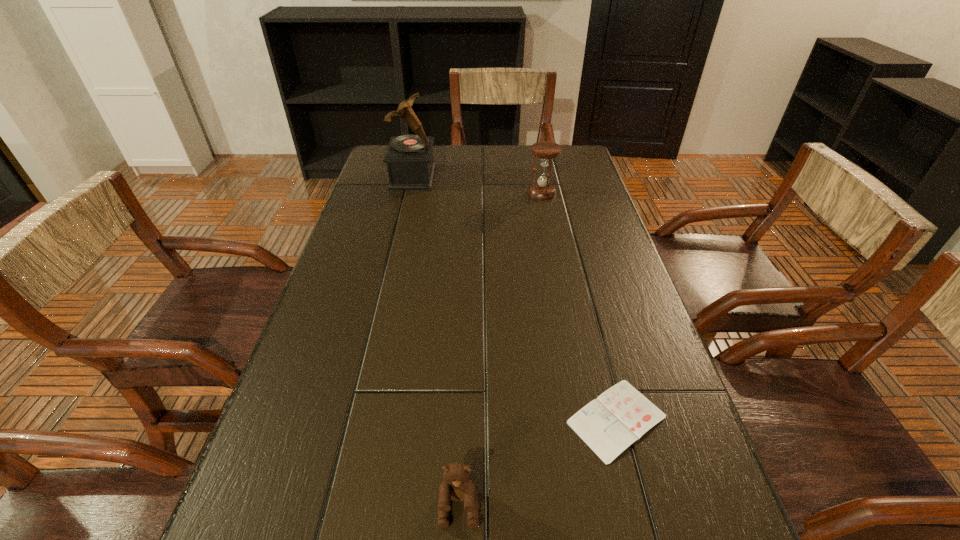
Find the location of a particular element. the leftmost object is located at coordinates (409, 158).

This screenshot has width=960, height=540. I want to click on phonograph_record, so click(409, 158).

At what (x,y) coordinates should I click in order to perform the action: click on hourglass. Please return your answer as a coordinate pair (x, y). The image size is (960, 540). Looking at the image, I should click on (545, 151).

Locate an element on the screen. the nearest object is located at coordinates (457, 487).

The height and width of the screenshot is (540, 960). I want to click on the second object from left to right, so click(x=457, y=487).

Locate an element on the screen. The width and height of the screenshot is (960, 540). diary is located at coordinates (621, 415).

You are a GUI agent. You are given a task and a screenshot of the screen. Output one action in this format:
    pyautogui.click(x=<x>, y=<y>)
    Task: Click on the third farthest object
    
    Given the screenshot: What is the action you would take?
    pyautogui.click(x=621, y=415)

Locate an element on the screen. vacant space located at the horn opening of the leftmost object is located at coordinates (455, 177).

At what (x,y) coordinates should I click in order to perform the action: click on free space located on the front of the second tallest object. Please return your answer as a coordinate pair (x, y). Looking at the image, I should click on point(557,264).

Identify the location of blank space located on the front of the second nearest object. The image size is (960, 540). (638, 502).